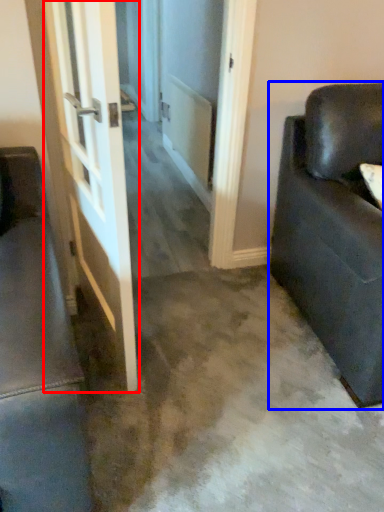
Question: Which object is further to the camera taking this photo, door (highlighted by a red box) or studio couch (highlighted by a blue box)?

Choices:
 (A) door
 (B) studio couch

Answer: (B)